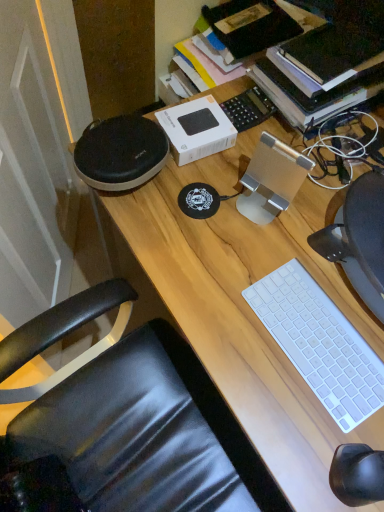
Find the location of a particular element. vacant space situated on the left part of white plastic keyboard at lower right is located at coordinates (223, 314).